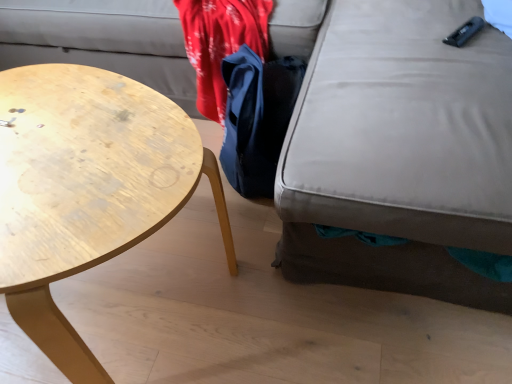
Question: From the image's perspective, is matte gray swivel chair at lower right on blue fabric bag at center?

Choices:
 (A) yes
 (B) no

Answer: (A)

Question: From a real-world perspective, is matte gray swivel chair at lower right located higher than blue fabric bag at center?

Choices:
 (A) no
 (B) yes

Answer: (B)

Question: Does matte gray swivel chair at lower right have a larger size compared to blue fabric bag at center?

Choices:
 (A) no
 (B) yes

Answer: (B)

Question: Can we say matte gray swivel chair at lower right lies outside blue fabric bag at center?

Choices:
 (A) yes
 (B) no

Answer: (A)

Question: Is matte gray swivel chair at lower right at the right side of blue fabric bag at center?

Choices:
 (A) no
 (B) yes

Answer: (B)

Question: From a real-world perspective, is blue fabric bag at center physically located above or below wooden coffee table at left?

Choices:
 (A) below
 (B) above

Answer: (A)

Question: In terms of width, does blue fabric bag at center look wider or thinner when compared to wooden coffee table at left?

Choices:
 (A) wide
 (B) thin

Answer: (B)

Question: From their relative heights in the image, would you say blue fabric bag at center is taller or shorter than wooden coffee table at left?

Choices:
 (A) short
 (B) tall

Answer: (A)

Question: Relative to wooden coffee table at left, is blue fabric bag at center in front or behind?

Choices:
 (A) behind
 (B) front

Answer: (A)

Question: Do you think blue fabric bag at center is within matte gray swivel chair at lower right, or outside of it?

Choices:
 (A) inside
 (B) outside

Answer: (B)

Question: From their relative heights in the image, would you say blue fabric bag at center is taller or shorter than matte gray swivel chair at lower right?

Choices:
 (A) short
 (B) tall

Answer: (A)

Question: Based on their sizes in the image, would you say blue fabric bag at center is bigger or smaller than matte gray swivel chair at lower right?

Choices:
 (A) big
 (B) small

Answer: (B)

Question: Relative to matte gray swivel chair at lower right, is blue fabric bag at center in front or behind?

Choices:
 (A) front
 (B) behind

Answer: (B)

Question: Would you say matte gray swivel chair at lower right is to the left or to the right of blue fabric bag at center in the picture?

Choices:
 (A) right
 (B) left

Answer: (A)

Question: Considering the positions of point (351, 96) and point (285, 92), is point (351, 96) closer or farther from the camera than point (285, 92)?

Choices:
 (A) closer
 (B) farther

Answer: (A)